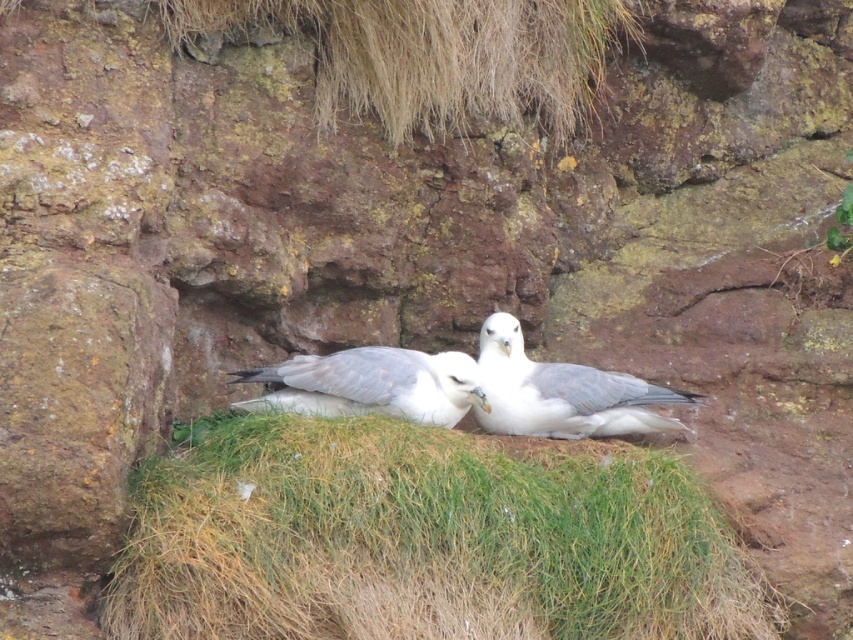
Does green grass at center have a smaller size compared to white matte bird at center?

Incorrect, green grass at center is not smaller in size than white matte bird at center.

Between green grass at center and white matte bird at center, which one has more height?

green grass at center

Where is `green grass at center`? The image size is (853, 640). green grass at center is located at coordinates (422, 540).

Who is positioned more to the right, white matte bird at center or white feathered bird at center?

white matte bird at center

Does point (498, 349) come closer to viewer compared to point (456, 365)?

That is False.

Is point (505, 387) farther from camera compared to point (242, 406)?

Yes, it is.

This screenshot has width=853, height=640. Find the location of `white matte bird at center`. white matte bird at center is located at coordinates (563, 392).

The height and width of the screenshot is (640, 853). Describe the element at coordinates (422, 540) in the screenshot. I see `green grass at center` at that location.

Is point (572, 632) farther from camera compared to point (341, 404)?

No, it is not.

The height and width of the screenshot is (640, 853). What do you see at coordinates (422, 540) in the screenshot?
I see `green grass at center` at bounding box center [422, 540].

Locate an element on the screen. This screenshot has width=853, height=640. green grass at center is located at coordinates (422, 540).